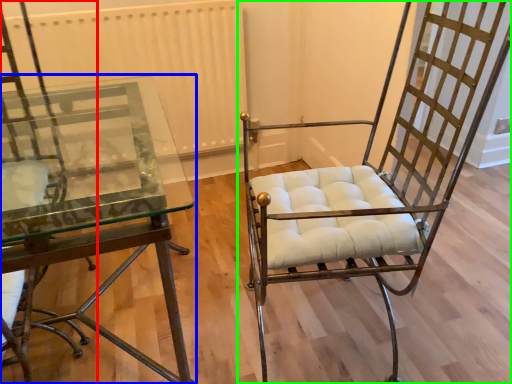
Question: Considering the real-world distances, which object is farthest from chair (highlighted by a red box)? table (highlighted by a blue box) or chair (highlighted by a green box)?

Choices:
 (A) table
 (B) chair

Answer: (B)